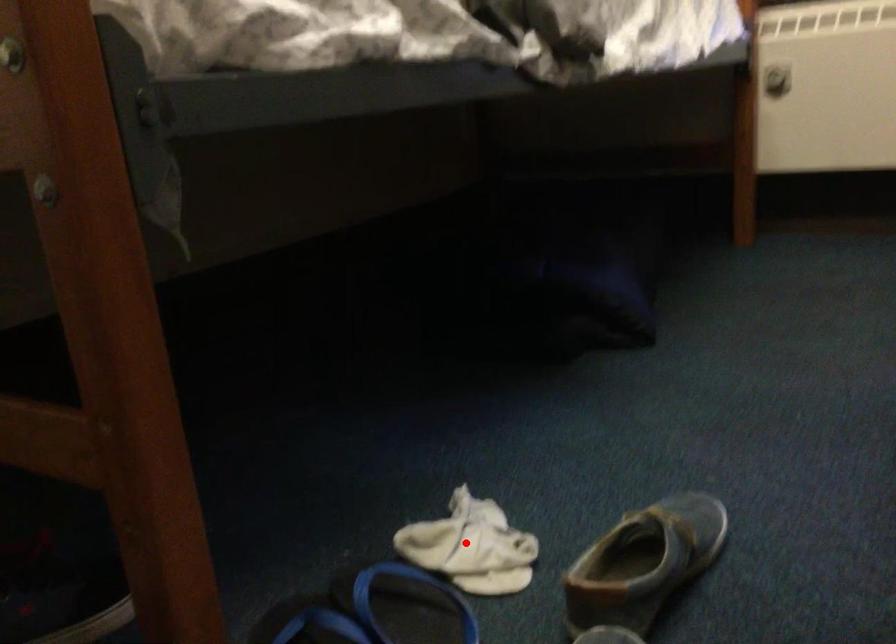
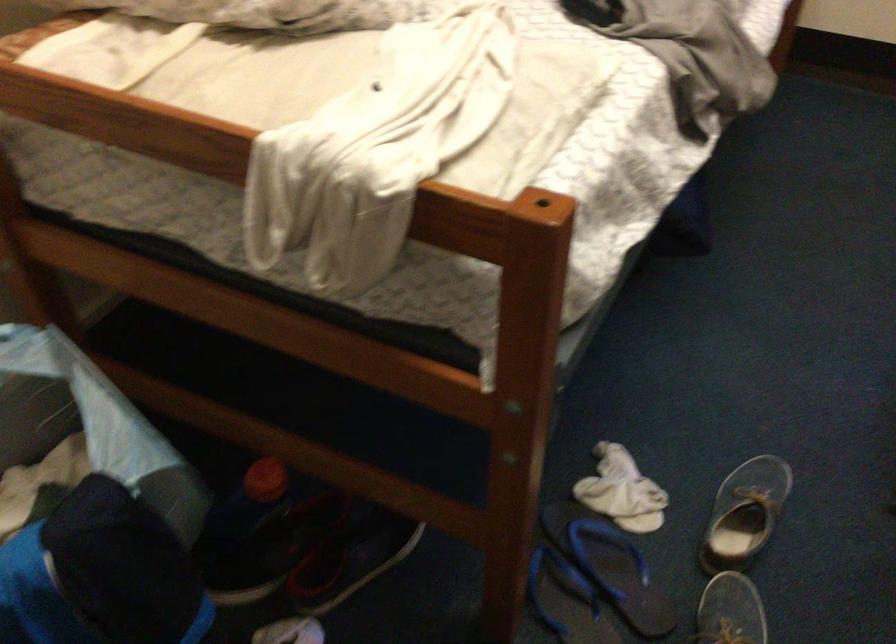
Question: I am providing you with two images of the same scene from different viewpoints. In image1, a red point is highlighted. Considering the same 3D point in image2, which of the following is correct?

Choices:
 (A) It is closer
 (B) It is farther

Answer: (B)